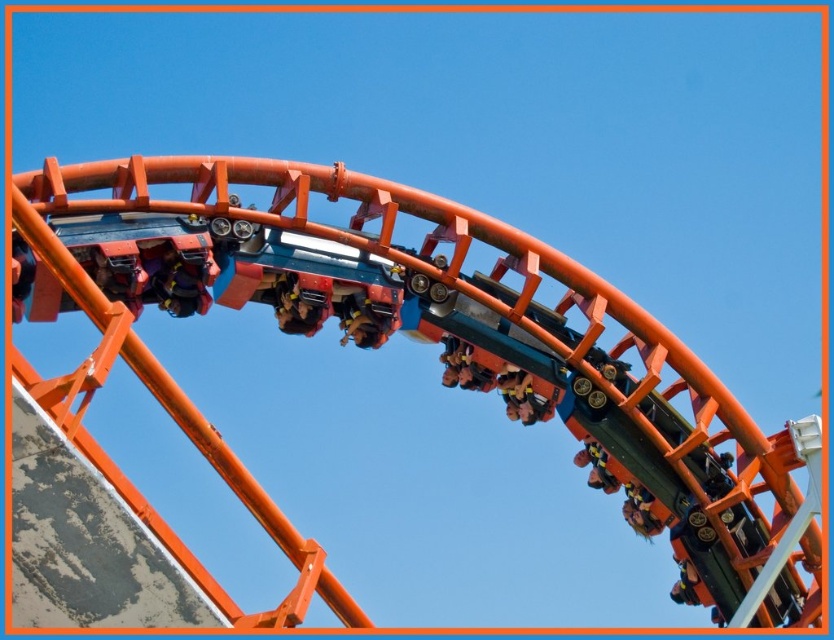
Question: Is metallic roller coaster at center smaller than metallic orange roller coaster car at center?

Choices:
 (A) no
 (B) yes

Answer: (A)

Question: Which point appears closest to the camera in this image?

Choices:
 (A) (471, 358)
 (B) (433, 275)

Answer: (B)

Question: Is metallic roller coaster at center positioned behind metallic orange roller coaster car at center?

Choices:
 (A) no
 (B) yes

Answer: (A)

Question: Which point is farther to the camera?

Choices:
 (A) metallic roller coaster at center
 (B) metallic orange roller coaster car at center

Answer: (B)

Question: Does metallic roller coaster at center appear under metallic orange roller coaster car at center?

Choices:
 (A) yes
 (B) no

Answer: (A)